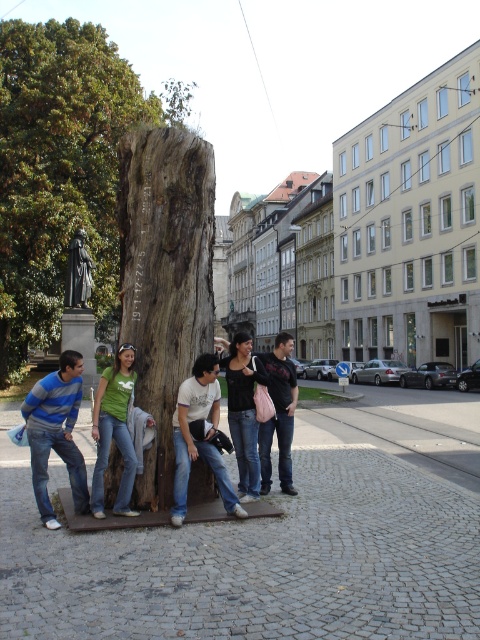
Can you confirm if wooden tree trunk at center is thinner than striped sweater at left?

Incorrect, wooden tree trunk at center's width is not less than striped sweater at left's.

Locate an element on the screen. This screenshot has height=640, width=480. wooden tree trunk at center is located at coordinates (165, 280).

Who is taller, dark gray jeans at center or bronze statue at center?

With more height is bronze statue at center.

Is point (280, 440) closer to camera compared to point (79, 256)?

Yes, it is in front of point (79, 256).

Identify the location of dark gray jeans at center. (278, 412).

Is point (169, 225) positioned behind point (195, 397)?

Yes, it is behind point (195, 397).

The width and height of the screenshot is (480, 640). In order to click on wooden tree trunk at center in this screenshot , I will do tap(165, 280).

Where is `wooden tree trunk at center`? Image resolution: width=480 pixels, height=640 pixels. wooden tree trunk at center is located at coordinates (165, 280).